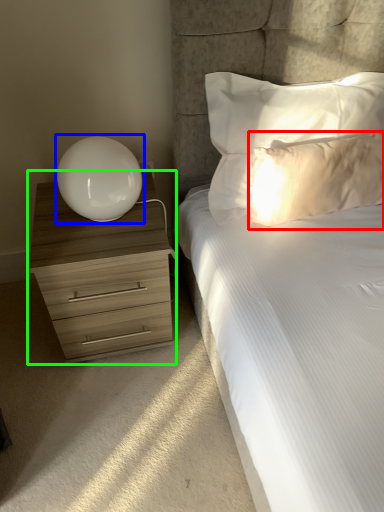
Question: Which object is the closest to the pillow (highlighted by a red box)? Choose among these: table lamp (highlighted by a blue box) or chest of drawers (highlighted by a green box).

Choices:
 (A) table lamp
 (B) chest of drawers

Answer: (A)